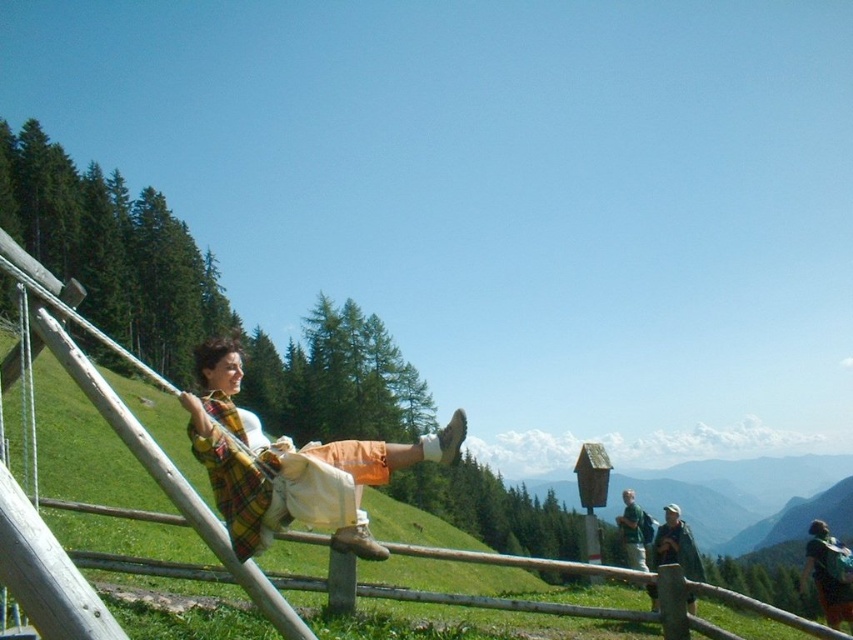
Question: Estimate the real-world distances between objects in this image. Which object is farther from the plaid fabric shirt at center?

Choices:
 (A) green fabric shirt at upper right
 (B) green fabric backpack at lower right

Answer: (B)

Question: Is green fabric backpack at lower right wider than green fabric shirt at upper right?

Choices:
 (A) no
 (B) yes

Answer: (B)

Question: Is plaid fabric shirt at center wider than camouflage jacket at lower right?

Choices:
 (A) yes
 (B) no

Answer: (B)

Question: Estimate the real-world distances between objects in this image. Which object is closer to the green fabric shirt at upper right?

Choices:
 (A) camouflage jacket at lower right
 (B) green fabric backpack at lower right

Answer: (A)

Question: Which of the following is the closest to the observer?

Choices:
 (A) plaid fabric shirt at center
 (B) camouflage jacket at lower right

Answer: (A)

Question: Where is plaid fabric shirt at center located in relation to green fabric shirt at upper right in the image?

Choices:
 (A) above
 (B) below

Answer: (A)